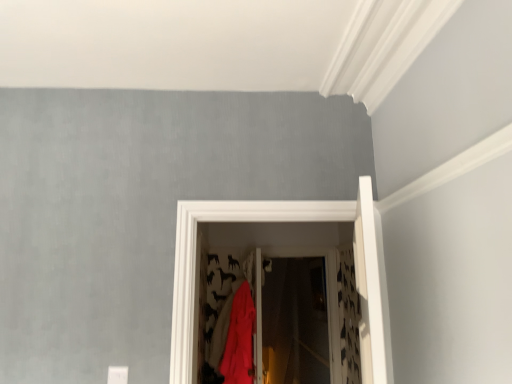
Question: Can you confirm if transparent plastic screen door at center is positioned to the right of matte red fabric at center?

Choices:
 (A) no
 (B) yes

Answer: (B)

Question: From the image's perspective, is transparent plastic screen door at center located beneath matte red fabric at center?

Choices:
 (A) no
 (B) yes

Answer: (A)

Question: Does transparent plastic screen door at center have a larger size compared to matte red fabric at center?

Choices:
 (A) yes
 (B) no

Answer: (B)

Question: Is matte red fabric at center located within transparent plastic screen door at center?

Choices:
 (A) yes
 (B) no

Answer: (B)

Question: Is transparent plastic screen door at center behind matte red fabric at center?

Choices:
 (A) no
 (B) yes

Answer: (B)

Question: Can we say transparent plastic screen door at center lies outside matte red fabric at center?

Choices:
 (A) no
 (B) yes

Answer: (B)

Question: Does matte red fabric at center have a greater width compared to transparent plastic screen door at center?

Choices:
 (A) no
 (B) yes

Answer: (B)

Question: Does matte red fabric at center touch transparent plastic screen door at center?

Choices:
 (A) no
 (B) yes

Answer: (A)

Question: From a real-world perspective, is matte red fabric at center physically above transparent plastic screen door at center?

Choices:
 (A) no
 (B) yes

Answer: (A)

Question: From the image's perspective, does matte red fabric at center appear higher than transparent plastic screen door at center?

Choices:
 (A) no
 (B) yes

Answer: (A)

Question: Can you confirm if matte red fabric at center is thinner than transparent plastic screen door at center?

Choices:
 (A) yes
 (B) no

Answer: (B)

Question: Considering the relative positions of matte red fabric at center and transparent plastic screen door at center in the image provided, is matte red fabric at center to the left of transparent plastic screen door at center from the viewer's perspective?

Choices:
 (A) no
 (B) yes

Answer: (B)

Question: From the image's perspective, relative to matte red fabric at center, is transparent plastic screen door at center above or below?

Choices:
 (A) above
 (B) below

Answer: (A)